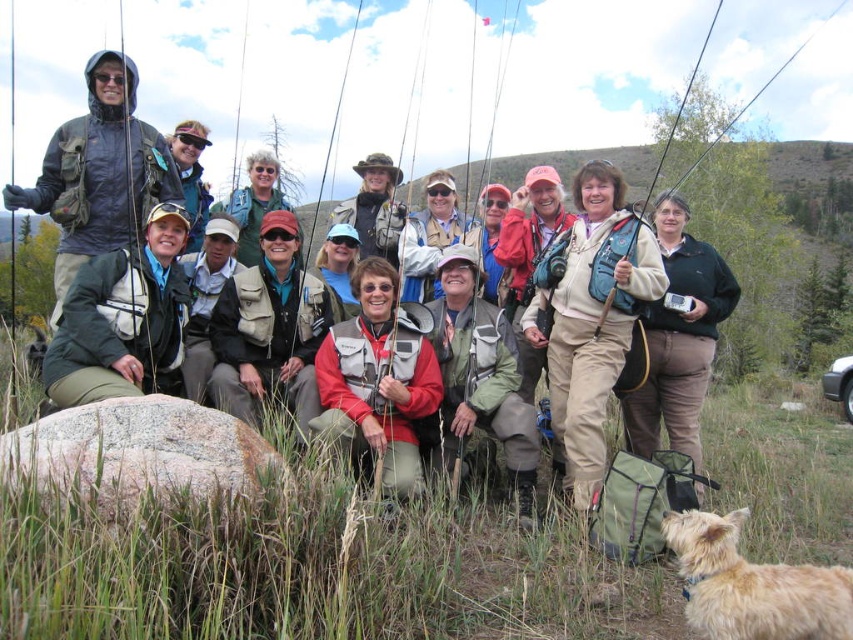
You are a photographer trying to capture a photo of the gray granite rock at lower left and the green fabric jacket at lower left. According to the scene, which object is positioned to the right side of the other?

Answer: The gray granite rock at lower left is to the right of the green fabric jacket at lower left.

You are a photographer trying to capture a group photo of the fishing enthusiasts. You notice the matte black jacket at upper left and the tan fabric jacket at center. Which jacket should you adjust to ensure both are fully visible in the frame?

The matte black jacket at upper left is much taller than the tan fabric jacket at center, so you should lower the camera angle or adjust the matte black jacket at upper left to ensure both are fully visible in the frame.